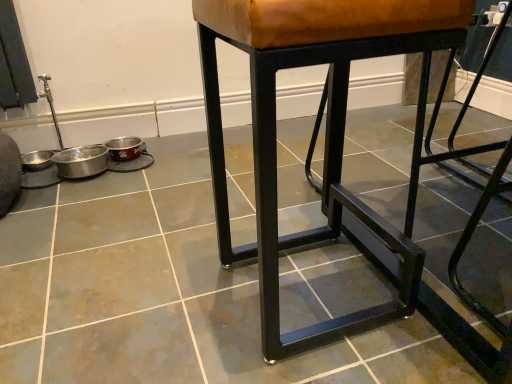
At what (x,y) coordinates should I click in order to perform the action: click on vacant area situated to the left side of brown leather stool at center. Please return your answer as a coordinate pair (x, y). Image resolution: width=512 pixels, height=384 pixels. Looking at the image, I should click on (164, 299).